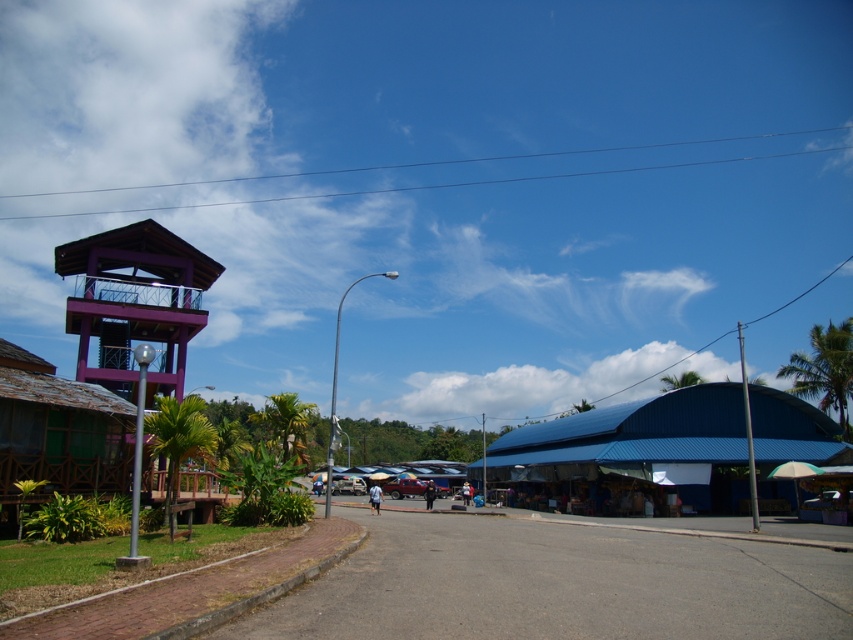
Question: Which point appears farthest from the camera in this image?

Choices:
 (A) (399, 480)
 (B) (660, 380)

Answer: (B)

Question: Which of the following is the closest to the observer?

Choices:
 (A) green leafy palm tree at upper center
 (B) green wooden hut at left
 (C) metallic red car at center
 (D) green leafy palm tree at center-left

Answer: (B)

Question: Can you confirm if purple wood tower at left is bigger than green leafy palm tree at right?

Choices:
 (A) yes
 (B) no

Answer: (B)

Question: Does blue corrugated metal hut at center appear under green leafy palm tree at center-left?

Choices:
 (A) yes
 (B) no

Answer: (B)

Question: Is green leafy palm tree at right behind metallic red car at center?

Choices:
 (A) yes
 (B) no

Answer: (B)

Question: Which of these objects is positioned farthest from the purple wood tower at left?

Choices:
 (A) metallic red car at center
 (B) green leafy palm tree at left
 (C) green leafy palm tree at right

Answer: (C)